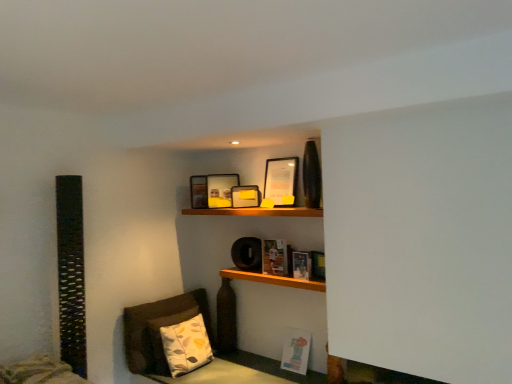
Find the location of `free space in front of matte paper book at lower right, the 1th book when ordered from bottom to top`. free space in front of matte paper book at lower right, the 1th book when ordered from bottom to top is located at coordinates (298, 379).